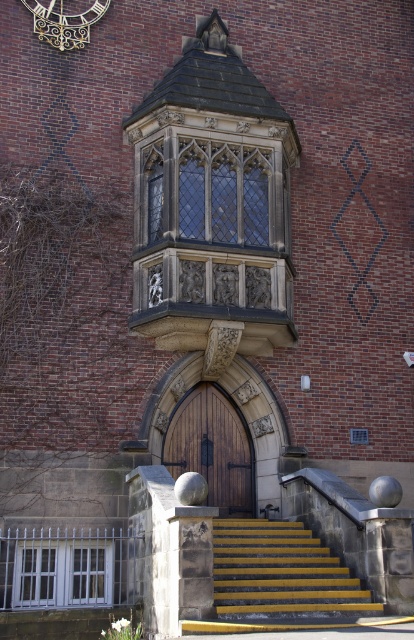
Question: Which of the following is the closest to the observer?

Choices:
 (A) (151, 179)
 (B) (320, 604)
 (C) (77, 600)
 (D) (24, 3)

Answer: (B)

Question: Among these objects, which one is farthest from the camera?

Choices:
 (A) clear glass window at center
 (B) yellow painted concrete stairs at center
 (C) wooden door at center

Answer: (C)

Question: Does yellow painted concrete stairs at center have a greater width compared to white glass window at lower left?

Choices:
 (A) yes
 (B) no

Answer: (A)

Question: In this image, where is yellow painted concrete stairs at center located relative to wooden door at center?

Choices:
 (A) left
 (B) right

Answer: (B)

Question: Is clear glass window at center in front of yellow painted concrete stairs at center?

Choices:
 (A) yes
 (B) no

Answer: (B)

Question: Which point is farther from the camera taking this photo?

Choices:
 (A) (47, 16)
 (B) (202, 218)

Answer: (A)